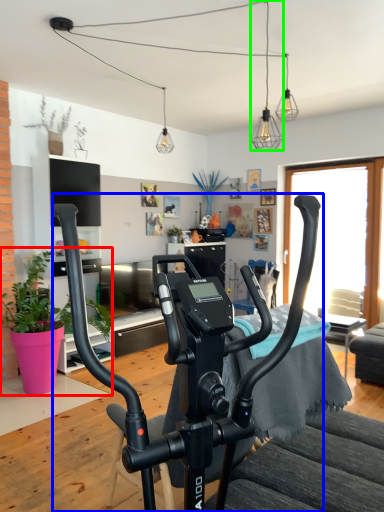
Question: Which object is the farthest from houseplant (highlighted by a red box)? Choose among these: stationary bicycle (highlighted by a blue box) or light fixture (highlighted by a green box).

Choices:
 (A) stationary bicycle
 (B) light fixture

Answer: (B)